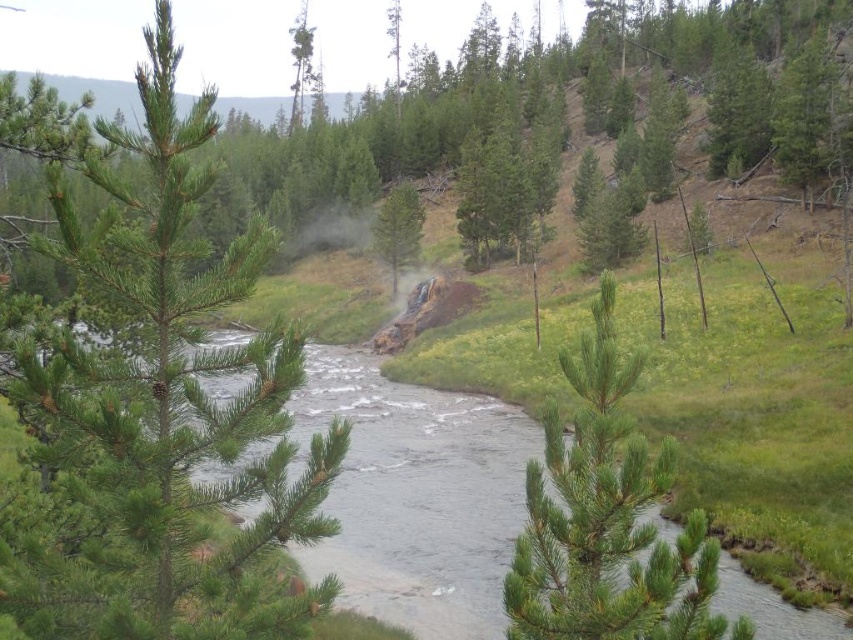
Question: Does clear water at center appear on the right side of green needle-like tree at center?

Choices:
 (A) yes
 (B) no

Answer: (B)

Question: Is clear water at center above green needle-like tree at center?

Choices:
 (A) yes
 (B) no

Answer: (B)

Question: Among these objects, which one is nearest to the camera?

Choices:
 (A) green needle-like pine at center
 (B) green pine tree at upper right
 (C) clear water at center

Answer: (C)

Question: Which of the following is the farthest from the observer?

Choices:
 (A) coord(166,288)
 (B) coord(296,26)

Answer: (B)

Question: Which object appears closest to the camera in this image?

Choices:
 (A) green pine tree at upper right
 (B) green needle-like pine at center

Answer: (B)

Question: Is clear water at center closer to camera compared to green needle-like tree at center?

Choices:
 (A) yes
 (B) no

Answer: (A)